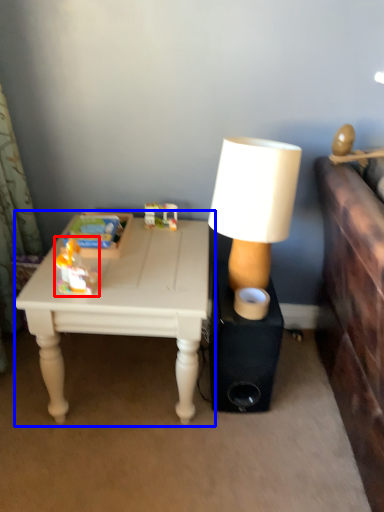
Question: Which object is further to the camera taking this photo, toy (highlighted by a red box) or table (highlighted by a blue box)?

Choices:
 (A) toy
 (B) table

Answer: (B)